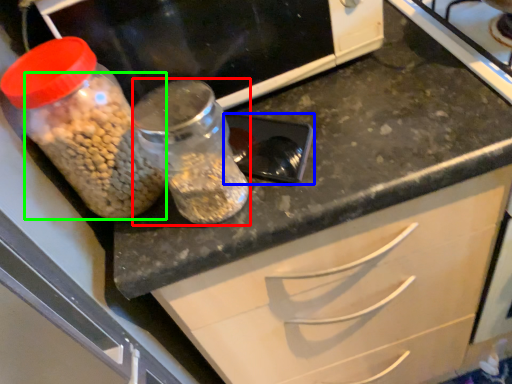
Question: Which is nearer to the glass jar (highlighted by a red box)? appliance (highlighted by a blue box) or food (highlighted by a green box).

Choices:
 (A) appliance
 (B) food

Answer: (B)